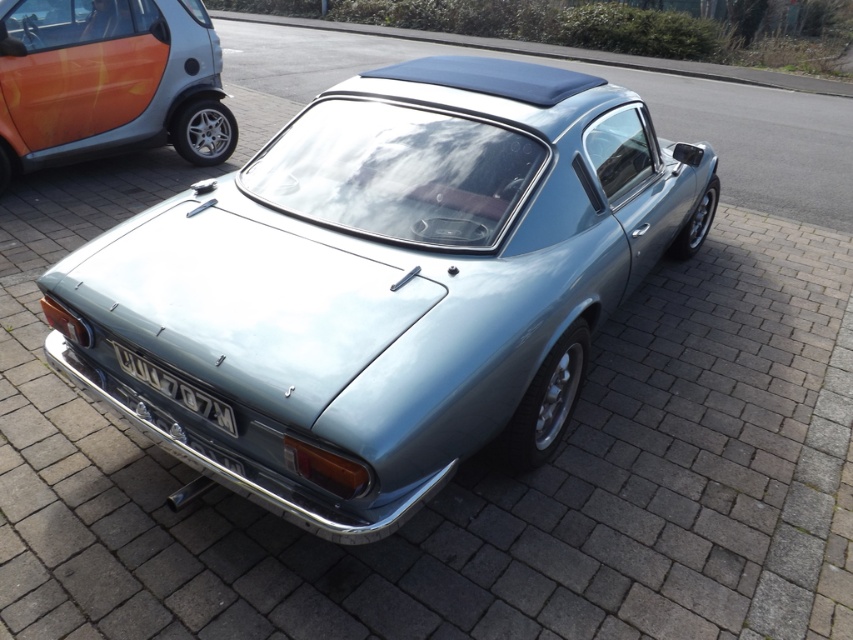
Question: Estimate the real-world distances between objects in this image. Which object is farther from the satin silver car at center?

Choices:
 (A) orange metallic car at left
 (B) gray metallic license plate at lower center

Answer: (A)

Question: Is satin silver car at center below orange metallic car at left?

Choices:
 (A) yes
 (B) no

Answer: (A)

Question: Does satin silver car at center appear on the left side of gray metallic license plate at lower center?

Choices:
 (A) yes
 (B) no

Answer: (B)

Question: Which point is closer to the camera?

Choices:
 (A) (171, 381)
 (B) (479, 196)
 (C) (71, 54)

Answer: (A)

Question: Observing the image, what is the correct spatial positioning of satin silver car at center in reference to gray metallic license plate at lower center?

Choices:
 (A) below
 (B) above

Answer: (B)

Question: Which of the following is the closest to the observer?

Choices:
 (A) (161, 372)
 (B) (492, 163)
 (C) (56, 8)

Answer: (A)